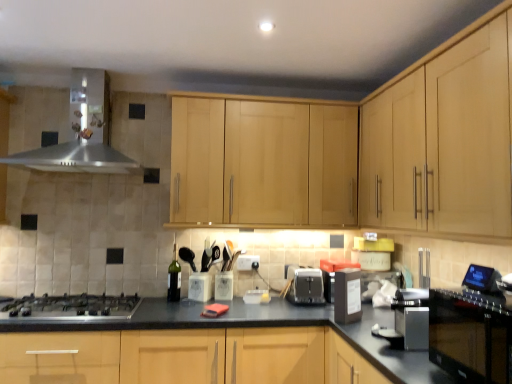
Question: Can you confirm if satin silver toaster at center, marked as the 2th appliance in a front-to-back arrangement, is smaller than black glossy oven at lower right?

Choices:
 (A) no
 (B) yes

Answer: (B)

Question: From the image's perspective, is satin silver toaster at center, which is the 2th appliance from right to left, beneath black glossy oven at lower right?

Choices:
 (A) no
 (B) yes

Answer: (B)

Question: From a real-world perspective, is satin silver toaster at center, marked as the 2th appliance in a front-to-back arrangement, located beneath black glossy oven at lower right?

Choices:
 (A) yes
 (B) no

Answer: (A)

Question: Can you confirm if satin silver toaster at center, which is the 2th appliance from right to left, is thinner than black glossy oven at lower right?

Choices:
 (A) no
 (B) yes

Answer: (B)

Question: Is satin silver toaster at center, which is the 2th appliance from right to left, wider than black glossy oven at lower right?

Choices:
 (A) yes
 (B) no

Answer: (B)

Question: Is satin silver toaster at center, which is the 2th appliance from right to left, closer to camera compared to black glossy oven at lower right?

Choices:
 (A) no
 (B) yes

Answer: (A)

Question: Does satin silver toaster at center, which is the 1th appliance in left-to-right order, have a greater height compared to light wood cabinet at upper right, the first cabinetry in the right-to-left sequence?

Choices:
 (A) yes
 (B) no

Answer: (B)

Question: Is satin silver toaster at center, marked as the 2th appliance in a front-to-back arrangement, far away from light wood cabinet at upper right, the first cabinetry in the right-to-left sequence?

Choices:
 (A) no
 (B) yes

Answer: (B)

Question: From a real-world perspective, is satin silver toaster at center, the first appliance in the back-to-front sequence, over light wood cabinet at upper right, the first cabinetry in the right-to-left sequence?

Choices:
 (A) yes
 (B) no

Answer: (B)

Question: From the image's perspective, does satin silver toaster at center, marked as the 2th appliance in a front-to-back arrangement, appear lower than light wood cabinet at upper right, the first cabinetry in the right-to-left sequence?

Choices:
 (A) no
 (B) yes

Answer: (B)

Question: Could you tell me if satin silver toaster at center, marked as the 2th appliance in a front-to-back arrangement, is facing light wood cabinet at upper right, which ranks as the second cabinetry in left-to-right order?

Choices:
 (A) no
 (B) yes

Answer: (A)

Question: From a real-world perspective, is satin silver toaster at center, which is the 2th appliance from right to left, physically below light wood cabinet at upper right, which ranks as the second cabinetry in left-to-right order?

Choices:
 (A) yes
 (B) no

Answer: (A)

Question: Is black plastic container at center-right, the 2th appliance viewed from the left, to the left of stainless steel range hood at upper left from the viewer's perspective?

Choices:
 (A) no
 (B) yes

Answer: (A)